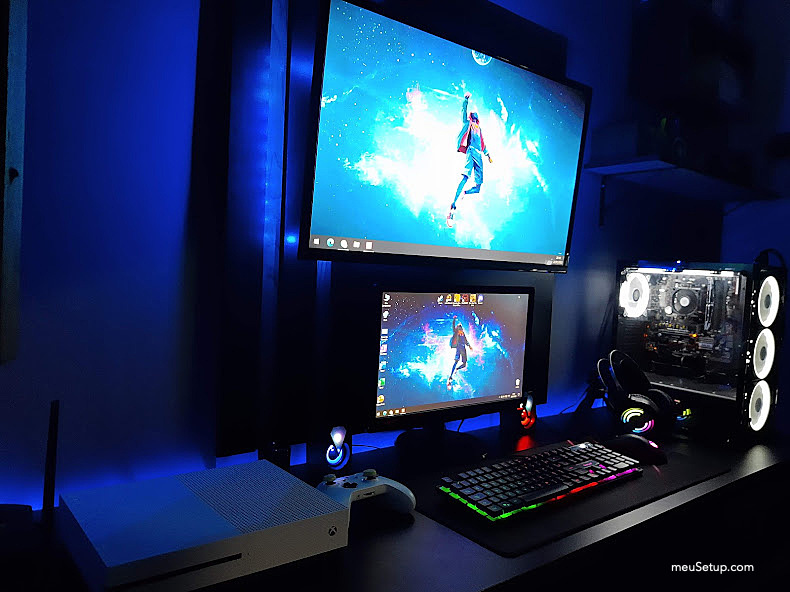
The image size is (790, 592). In order to click on gaming pc in this screenshot , I will do `click(716, 315)`.